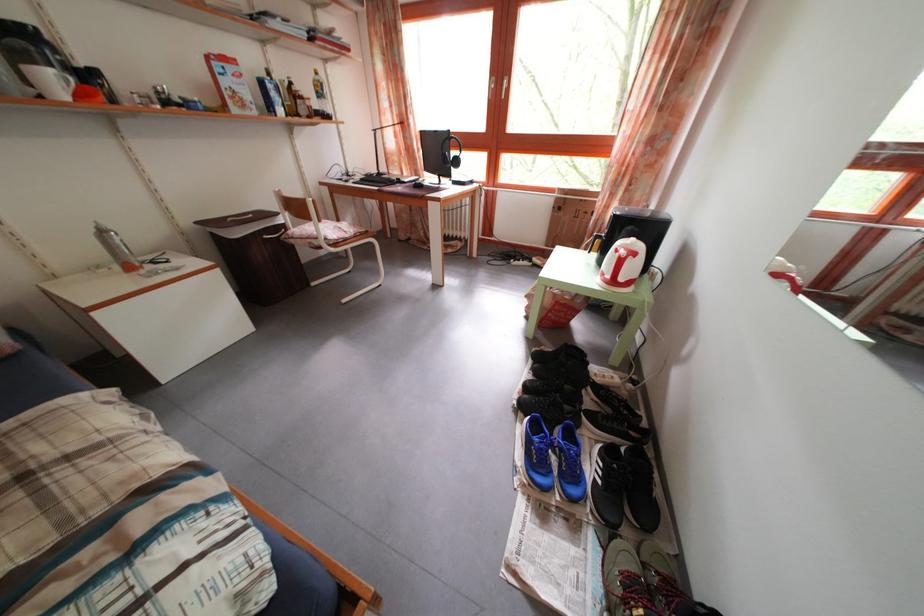
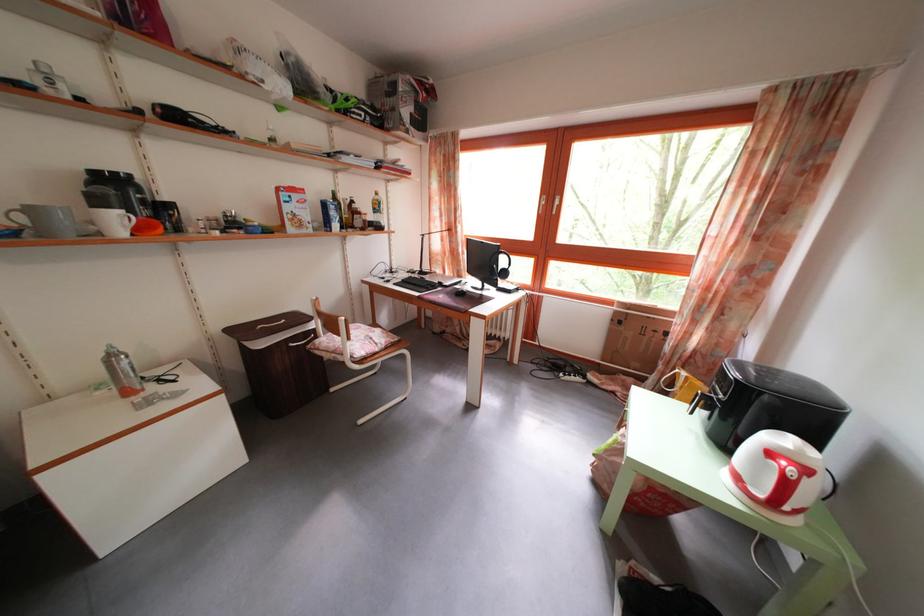
The point at [108,238] is marked in the first image. Where is the corresponding point in the second image?

(118, 363)